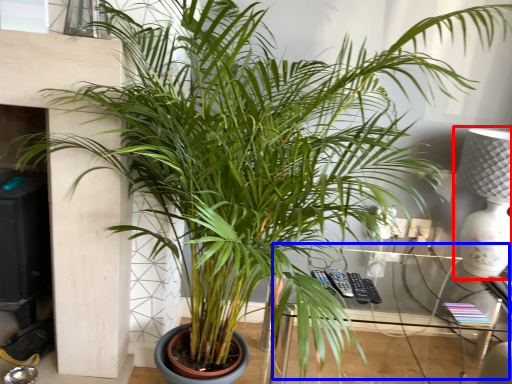
Question: Among these objects, which one is nearest to the camera, table lamp (highlighted by a red box) or table (highlighted by a blue box)?

Choices:
 (A) table lamp
 (B) table

Answer: (B)